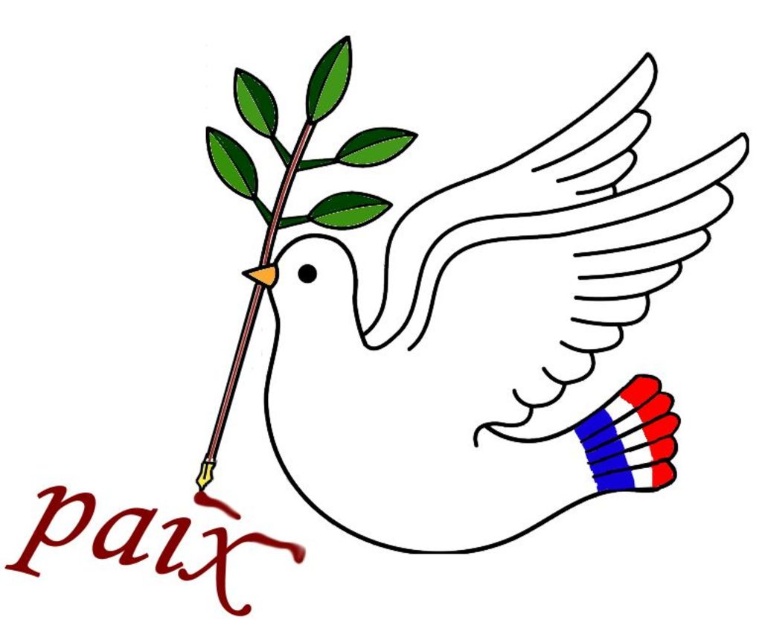
Between point (396, 477) and point (341, 42), which one is positioned behind?

Positioned behind is point (396, 477).

Locate an element on the screen. The image size is (762, 640). white matte dove at center is located at coordinates (456, 346).